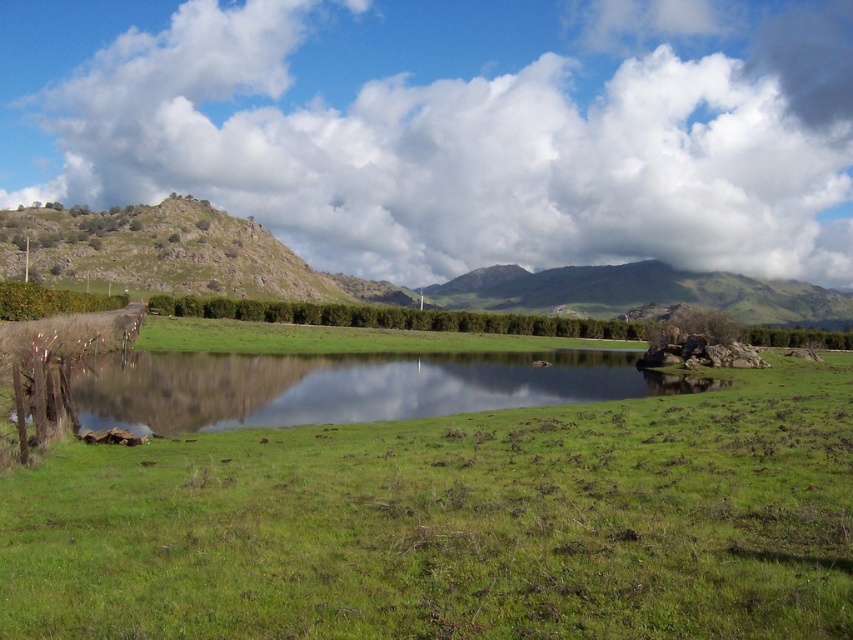
Question: Which object is positioned farthest from the green grassy at center?

Choices:
 (A) green grassy lake at center
 (B) green grassy hill at center

Answer: (B)

Question: Considering the real-world distances, which object is closest to the cloudy sky at upper center?

Choices:
 (A) green grassy at center
 (B) green grassy hill at center
 (C) green grassy lake at center

Answer: (B)

Question: Among these objects, which one is farthest from the camera?

Choices:
 (A) cloudy sky at upper center
 (B) green grassy at center
 (C) green grassy hill at center
 (D) green grassy lake at center

Answer: (A)

Question: Considering the relative positions of green grassy at center and green grassy lake at center in the image provided, where is green grassy at center located with respect to green grassy lake at center?

Choices:
 (A) above
 (B) below

Answer: (B)

Question: Can you confirm if green grassy at center is positioned to the right of green grassy hill at center?

Choices:
 (A) no
 (B) yes

Answer: (A)

Question: Can you confirm if green grassy lake at center is bigger than green grassy hill at center?

Choices:
 (A) no
 (B) yes

Answer: (A)